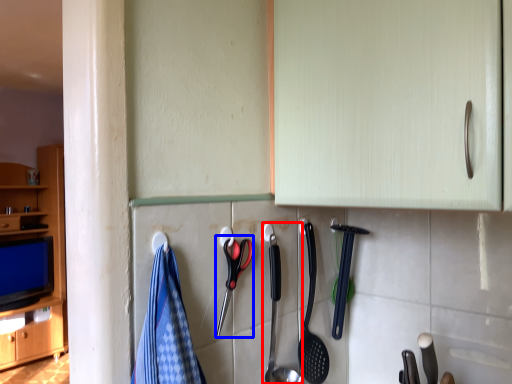
Question: Among these objects, which one is farthest to the camera, silverware (highlighted by a red box) or scissors (highlighted by a blue box)?

Choices:
 (A) silverware
 (B) scissors

Answer: (A)